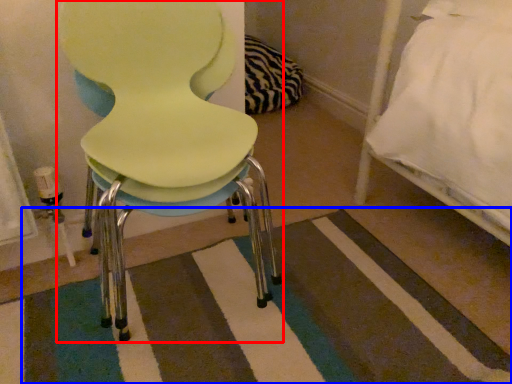
Question: Among these objects, which one is farthest to the camera, chair (highlighted by a red box) or mat (highlighted by a blue box)?

Choices:
 (A) chair
 (B) mat

Answer: (B)